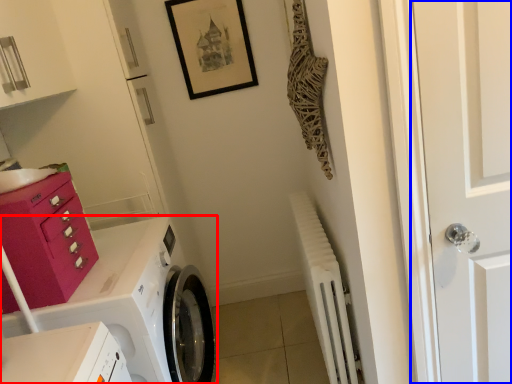
Question: Which point is closer to the camera, washing machine (highlighted by a red box) or door (highlighted by a blue box)?

Choices:
 (A) washing machine
 (B) door

Answer: (B)